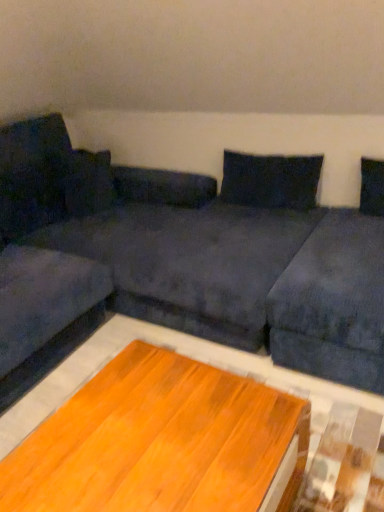
Question: Does velvet dark blue couch at left appear on the right side of wooden table at center?

Choices:
 (A) no
 (B) yes

Answer: (A)

Question: Does velvet dark blue couch at left come behind wooden table at center?

Choices:
 (A) yes
 (B) no

Answer: (A)

Question: From the image's perspective, does velvet dark blue couch at left appear lower than wooden table at center?

Choices:
 (A) yes
 (B) no

Answer: (B)

Question: Does velvet dark blue couch at left have a lesser width compared to wooden table at center?

Choices:
 (A) no
 (B) yes

Answer: (A)

Question: Is velvet dark blue couch at left wider than wooden table at center?

Choices:
 (A) no
 (B) yes

Answer: (B)

Question: Is velvet dark blue couch at left outside wooden table at center?

Choices:
 (A) yes
 (B) no

Answer: (A)

Question: Does dark blue fabric couch at center have a lesser height compared to velvet dark blue couch at left?

Choices:
 (A) yes
 (B) no

Answer: (B)

Question: Considering the relative sizes of dark blue fabric couch at center and velvet dark blue couch at left in the image provided, is dark blue fabric couch at center thinner than velvet dark blue couch at left?

Choices:
 (A) yes
 (B) no

Answer: (B)

Question: Is dark blue fabric couch at center completely or partially outside of velvet dark blue couch at left?

Choices:
 (A) no
 (B) yes

Answer: (B)

Question: Is dark blue fabric couch at center closer to the viewer compared to velvet dark blue couch at left?

Choices:
 (A) yes
 (B) no

Answer: (A)

Question: Considering the relative sizes of dark blue fabric couch at center and velvet dark blue couch at left in the image provided, is dark blue fabric couch at center bigger than velvet dark blue couch at left?

Choices:
 (A) yes
 (B) no

Answer: (A)

Question: Considering the relative sizes of dark blue fabric couch at center and velvet dark blue couch at left in the image provided, is dark blue fabric couch at center wider than velvet dark blue couch at left?

Choices:
 (A) no
 (B) yes

Answer: (B)

Question: Is velvet dark blue couch at left smaller than dark blue fabric pillow at upper center?

Choices:
 (A) yes
 (B) no

Answer: (B)